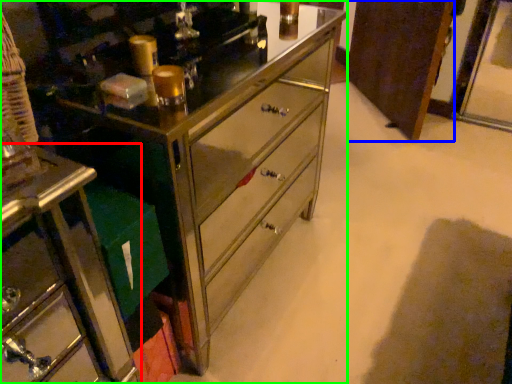
Question: Which object is positioned farthest from furniture (highlighted by a red box)? Select from cabinetry (highlighted by a blue box) and chest of drawers (highlighted by a green box).

Choices:
 (A) cabinetry
 (B) chest of drawers

Answer: (A)